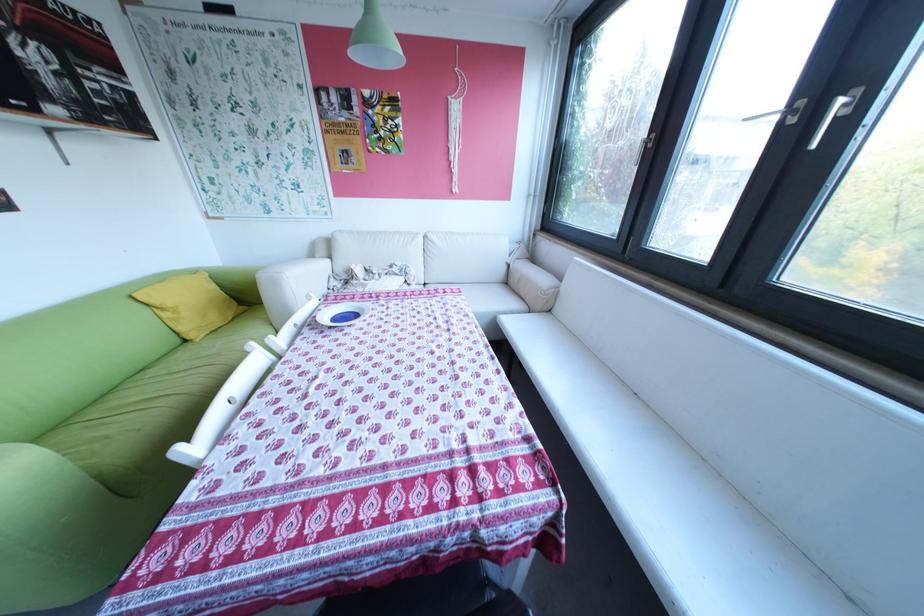
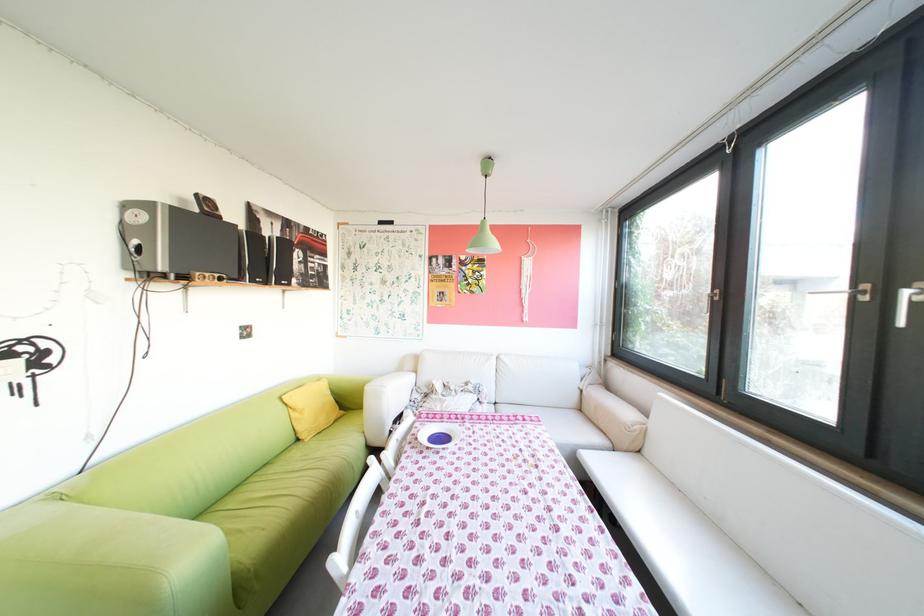
Where in the second image is the point corresponding to point (175, 309) from the first image?

(307, 410)